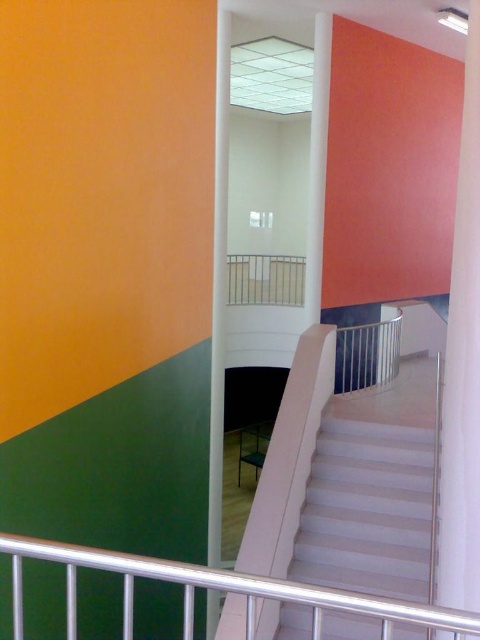
Who is positioned more to the right, silver metallic railing at lower center or metallic silver balustrade at center?

metallic silver balustrade at center is more to the right.

From the picture: Is silver metallic railing at lower center wider than metallic silver balustrade at center?

No, silver metallic railing at lower center is not wider than metallic silver balustrade at center.

Describe the element at coordinates (215, 589) in the screenshot. The height and width of the screenshot is (640, 480). I see `silver metallic railing at lower center` at that location.

Find the location of a particular element. The width and height of the screenshot is (480, 640). silver metallic railing at lower center is located at coordinates (215, 589).

Is white glossy pillar at center above silver metallic railing at lower center?

Yes, white glossy pillar at center is above silver metallic railing at lower center.

Is white glossy pillar at center bigger than silver metallic railing at lower center?

Correct, white glossy pillar at center is larger in size than silver metallic railing at lower center.

Between point (451, 429) and point (222, 588), which one is positioned behind?

The point (451, 429) is more distant.

Identify the location of white glossy pillar at center. The width and height of the screenshot is (480, 640). (463, 364).

What are the coordinates of `white glossy column at center` in the screenshot? It's located at (317, 166).

Does white glossy column at center appear on the right side of metallic silver balustrade at center?

Yes, white glossy column at center is to the right of metallic silver balustrade at center.

Which is behind, point (324, 118) or point (304, 257)?

The point (304, 257) is behind.

This screenshot has height=640, width=480. Find the location of `white glossy column at center`. white glossy column at center is located at coordinates (317, 166).